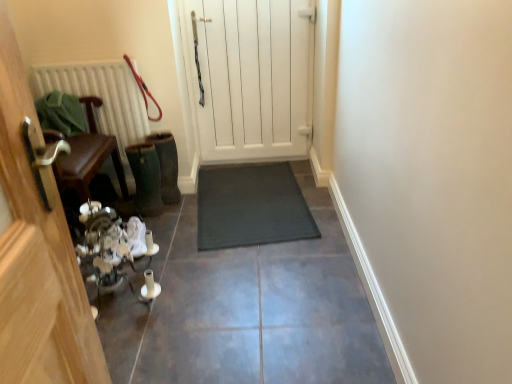
Identify the location of blank area beneath white wooden door at center, which appears as the second door when viewed from the front (from a real-world perspective). pyautogui.click(x=247, y=162).